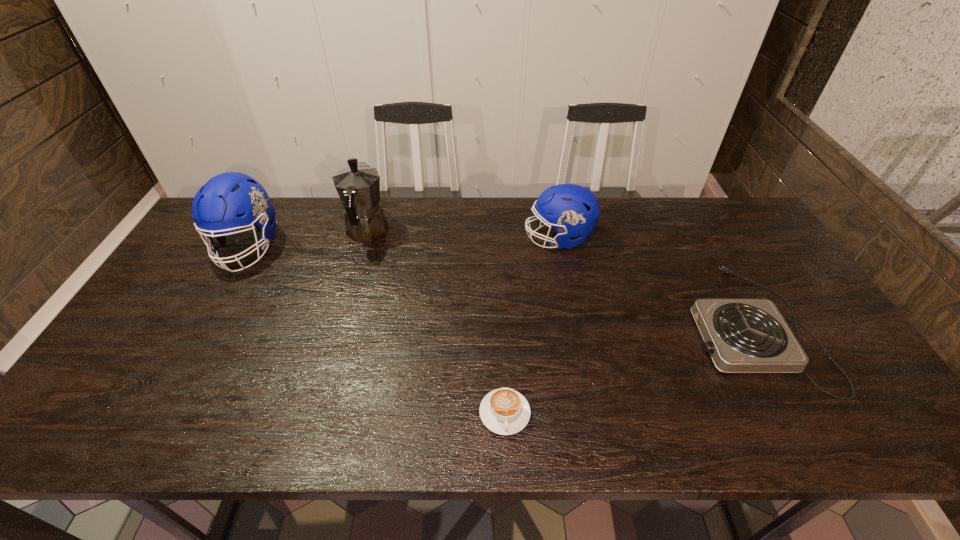
Image resolution: width=960 pixels, height=540 pixels. In order to click on free space at the near edge of the desktop in this screenshot , I will do `click(577, 411)`.

Locate an element on the screen. The image size is (960, 540). vacant area at the left edge is located at coordinates (192, 299).

Find the location of a particular element. This screenshot has height=540, width=960. blank space at the right edge is located at coordinates [x=811, y=368].

You are a GUI agent. You are given a task and a screenshot of the screen. Output one action in this format:
    pyautogui.click(x=<x>, y=<y>)
    Task: Click on the vacant space at the far right corner of the desktop
    This screenshot has width=960, height=540.
    Given the screenshot: What is the action you would take?
    coord(734,231)

Locate an element on the screen. This screenshot has height=540, width=960. empty space that is in between the second object from left to right and the hotplate is located at coordinates (559, 280).

The width and height of the screenshot is (960, 540). I want to click on vacant point located between the right football helmet and the second object from left to right, so click(x=463, y=235).

Image resolution: width=960 pixels, height=540 pixels. Identify the location of vacant region between the third object from right to left and the fourth object from right to left. (436, 323).

The width and height of the screenshot is (960, 540). In order to click on vacant area between the third tallest object and the taller football helmet in this screenshot , I will do `click(403, 242)`.

In order to click on free space between the shorter football helmet and the hotplate in this screenshot , I will do `click(655, 282)`.

The width and height of the screenshot is (960, 540). Find the location of `empty location between the third shortest object and the hotplate`. empty location between the third shortest object and the hotplate is located at coordinates (655, 282).